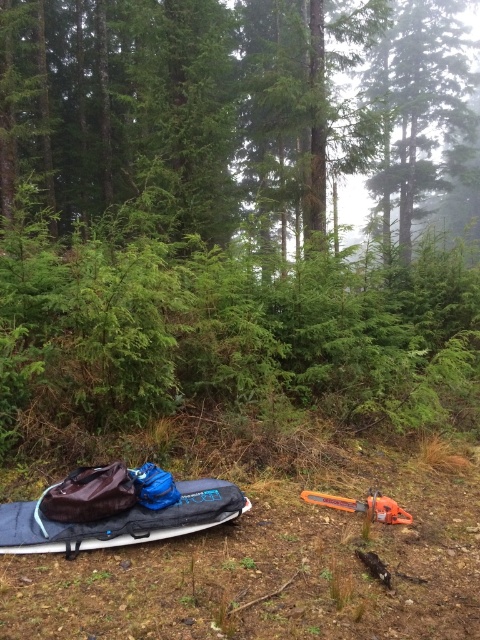
From the picture: You are a hiker who has just arrived at the forest scene. You need to retrieve the orange plastic chainsaw at lower right but must avoid touching the green matte tree at upper center. Can you reach the chainsaw without going under the tree?

The green matte tree at upper center is above the orange plastic chainsaw at lower right, so you can reach the chainsaw without going under the tree by moving around it or approaching from the sides since the tree is positioned above the chainsaw.